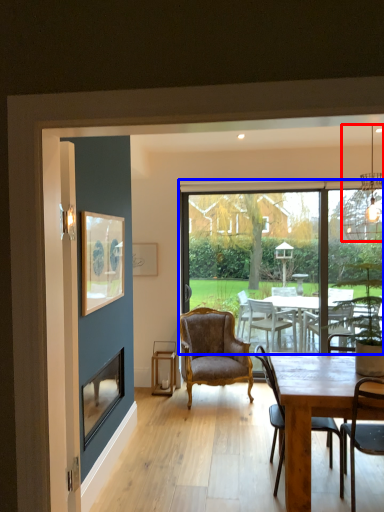
Question: Which object is further to the camera taking this photo, lamp (highlighted by a red box) or window (highlighted by a blue box)?

Choices:
 (A) lamp
 (B) window

Answer: (B)